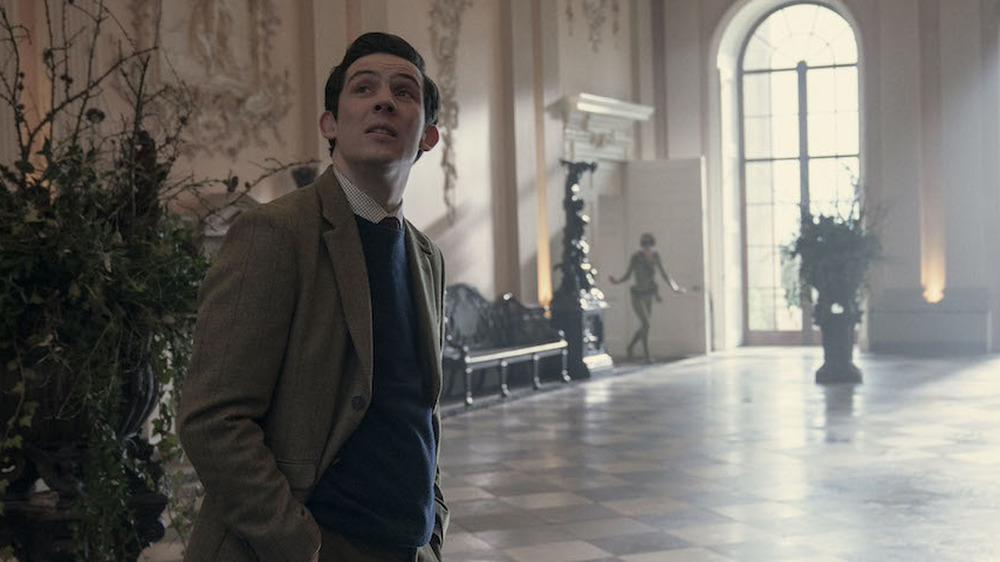
I want to click on plant, so click(142, 334).